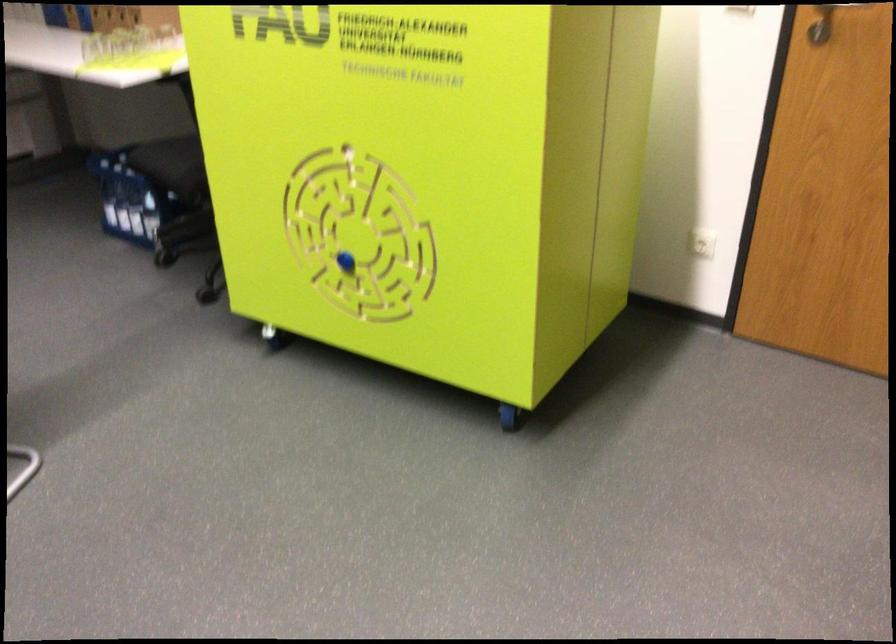
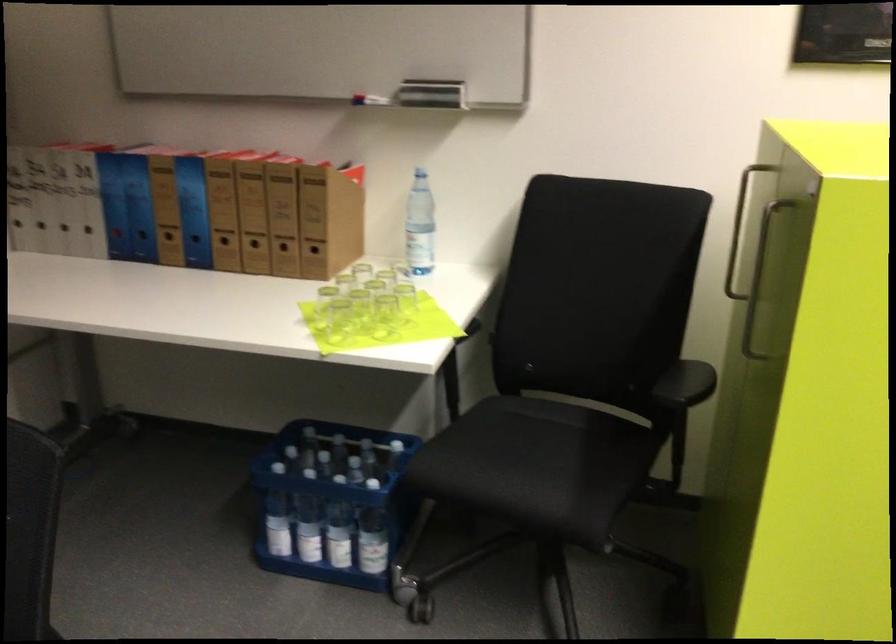
The images are taken continuously from a first-person perspective. In which direction are you moving?

The cameraman walked toward left, forward.